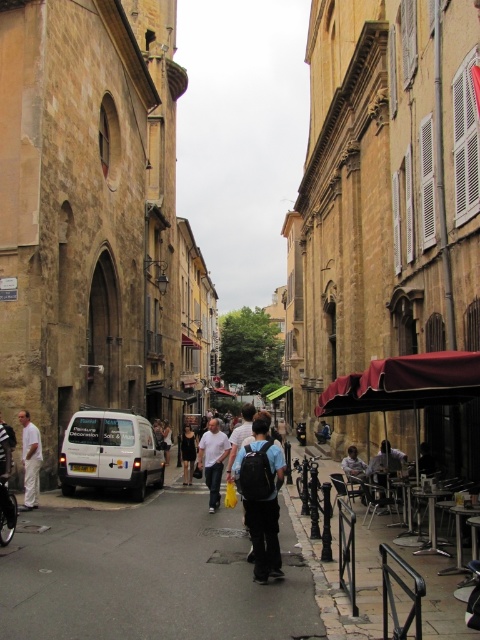
Does light blue shirt at center have a lesser height compared to light blue shirt at lower center?

No.

Locate an element on the screen. Image resolution: width=480 pixels, height=640 pixels. light blue shirt at center is located at coordinates (384, 464).

Identify the location of light blue shirt at center. Image resolution: width=480 pixels, height=640 pixels. (384, 464).

Can you confirm if gray asphalt pavement at center is shorter than white cotton shirt at center?

Yes, gray asphalt pavement at center is shorter than white cotton shirt at center.

Is gray asphalt pavement at center to the left of white cotton shirt at center from the viewer's perspective?

Yes, gray asphalt pavement at center is to the left of white cotton shirt at center.

Is point (219, 576) more distant than point (216, 486)?

No, (219, 576) is in front of (216, 486).

I want to click on gray asphalt pavement at center, so click(x=146, y=577).

Is matte black backpack at center to the right of white cotton pants at lower left from the viewer's perspective?

Yes, matte black backpack at center is to the right of white cotton pants at lower left.

Can you confirm if matte black backpack at center is positioned below white cotton pants at lower left?

Indeed, matte black backpack at center is positioned under white cotton pants at lower left.

Measure the distance between point (262, 502) and camera.

Point (262, 502) is 16.09 meters away from camera.

What are the coordinates of `matte black backpack at center` in the screenshot? It's located at (263, 502).